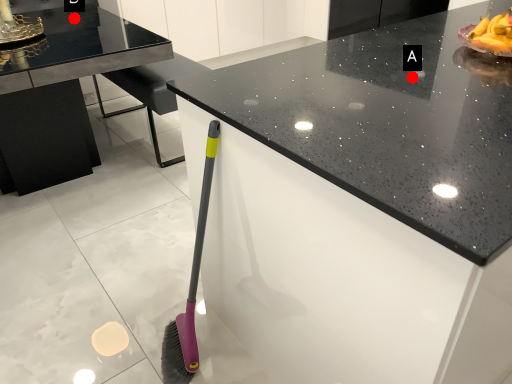
Question: Two points are circled on the image, labeled by A and B beside each circle. Which point is farther from the camera taking this photo?

Choices:
 (A) A is further
 (B) B is further

Answer: (B)